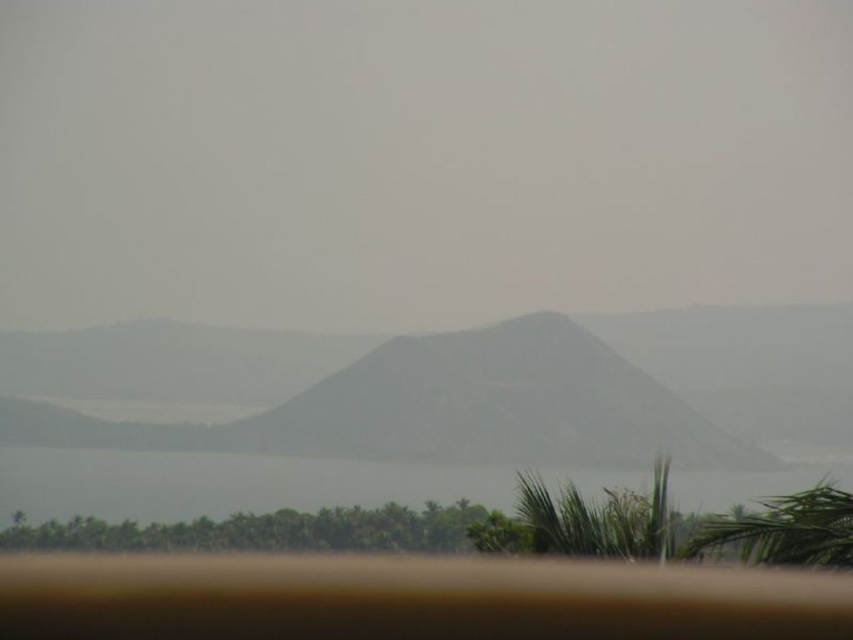
Question: Does gray textured mountain at center come in front of transparent water at lower center?

Choices:
 (A) yes
 (B) no

Answer: (B)

Question: Can you confirm if gray textured mountain at center is smaller than transparent water at lower center?

Choices:
 (A) yes
 (B) no

Answer: (A)

Question: Among these points, which one is farthest from the camera?

Choices:
 (A) (100, 387)
 (B) (392, 464)

Answer: (A)

Question: Is gray textured mountain at center positioned at the back of transparent water at lower center?

Choices:
 (A) no
 (B) yes

Answer: (B)